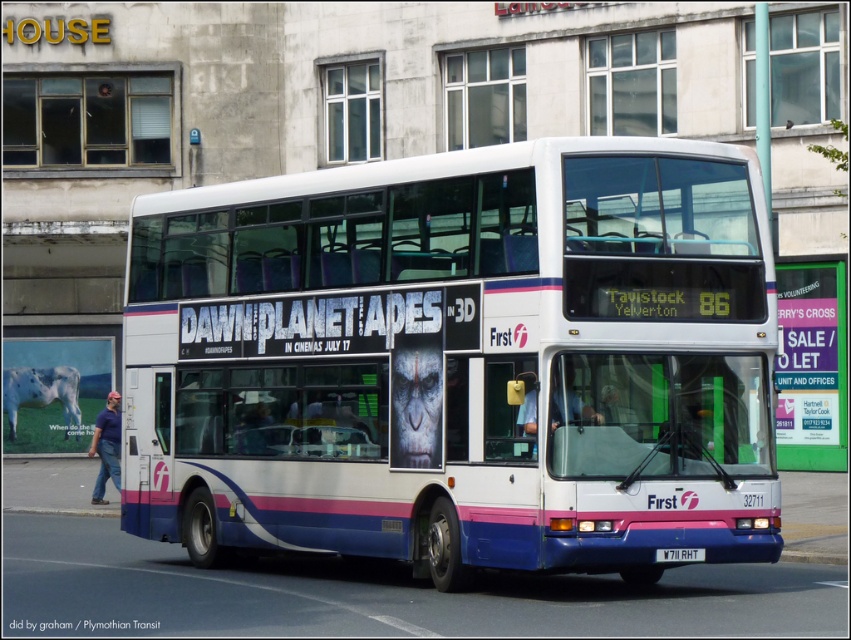
Based on the photo, who is positioned more to the right, white matte/deck bus at center or white plastic license plate at center?

Positioned to the right is white plastic license plate at center.

Is white matte/deck bus at center positioned in front of white plastic license plate at center?

Yes, it is in front of white plastic license plate at center.

Does point (553, 545) come behind point (683, 554)?

That is False.

The width and height of the screenshot is (851, 640). What are the coordinates of `white matte/deck bus at center` in the screenshot? It's located at (460, 360).